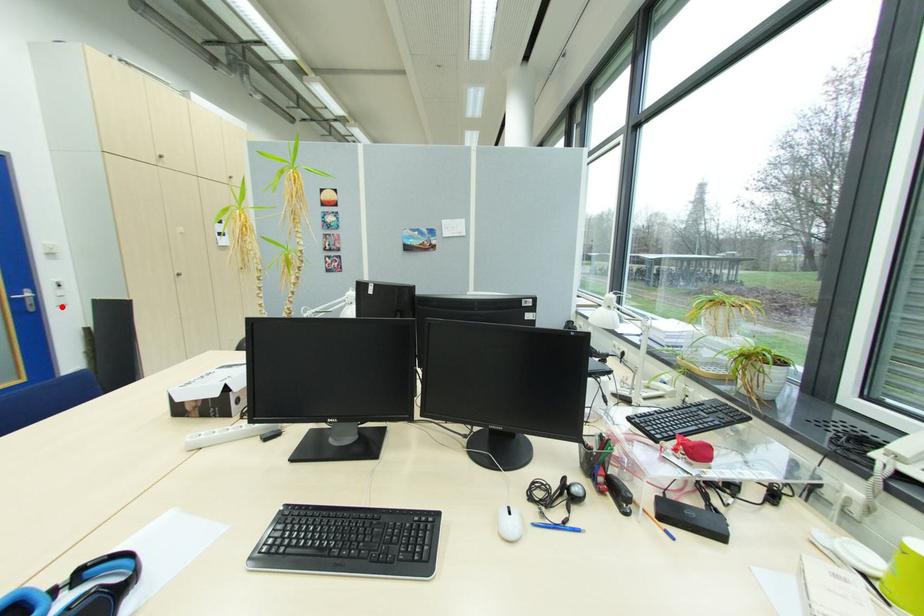
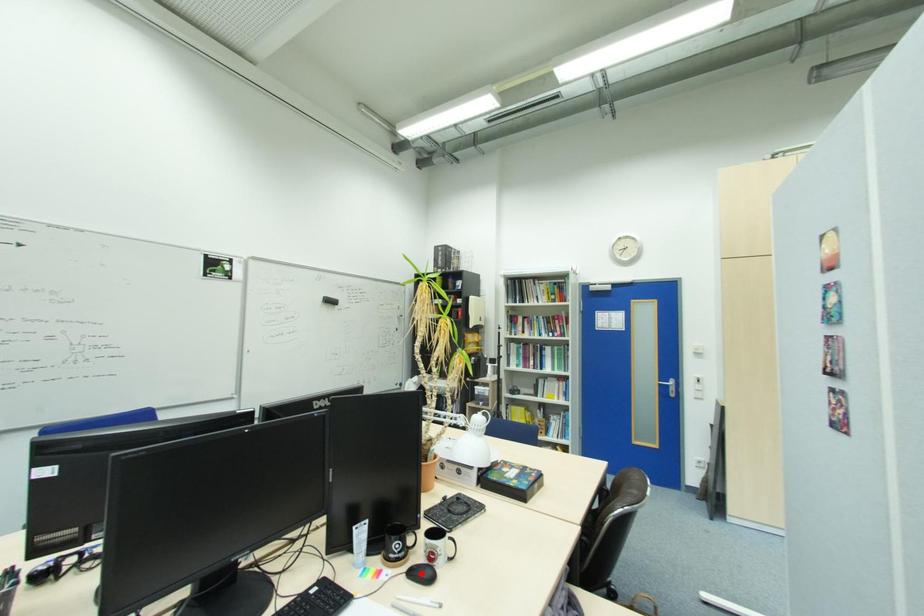
I am providing you with two images of the same scene from different viewpoints. A red point is marked on the first image and another point is marked on the second image. Is the marked point in image1 the same physical position as the marked point in image2?

No